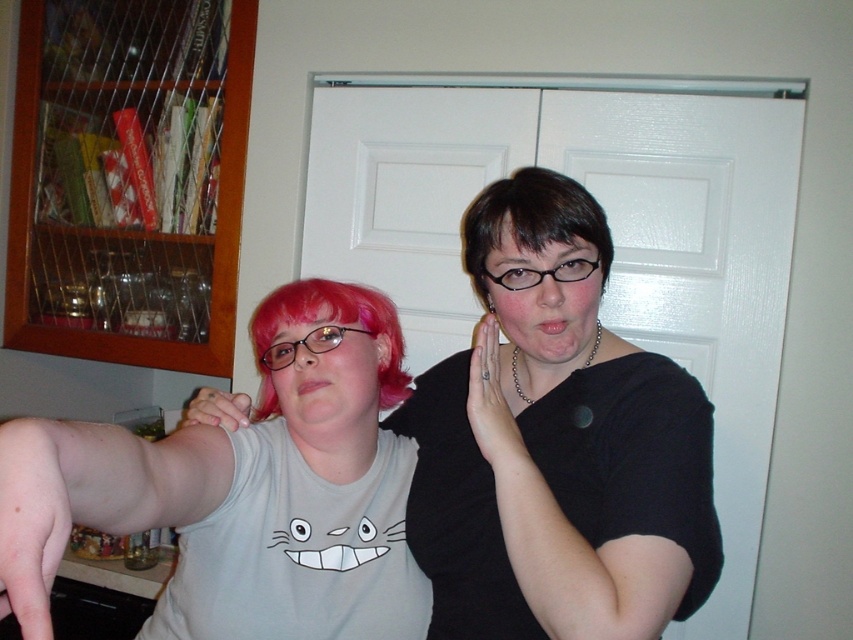
Is black matte shirt at center shorter than pink synthetic wig at center?

Incorrect, black matte shirt at center's height does not fall short of pink synthetic wig at center's.

Locate an element on the screen. This screenshot has width=853, height=640. black matte shirt at center is located at coordinates (555, 444).

I want to click on black matte shirt at center, so click(x=555, y=444).

Is black matte shirt at center below pale flesh muscle at lower left?

Actually, black matte shirt at center is above pale flesh muscle at lower left.

Is black matte shirt at center bigger than pale flesh muscle at lower left?

Yes.

Locate an element on the screen. Image resolution: width=853 pixels, height=640 pixels. black matte shirt at center is located at coordinates (555, 444).

Does light gray cotton tank top at center lie behind pale flesh muscle at lower left?

No, it is in front of pale flesh muscle at lower left.

Does light gray cotton tank top at center appear on the left side of pale flesh muscle at lower left?

No, light gray cotton tank top at center is not to the left of pale flesh muscle at lower left.

Where is `light gray cotton tank top at center`? This screenshot has width=853, height=640. light gray cotton tank top at center is located at coordinates (244, 490).